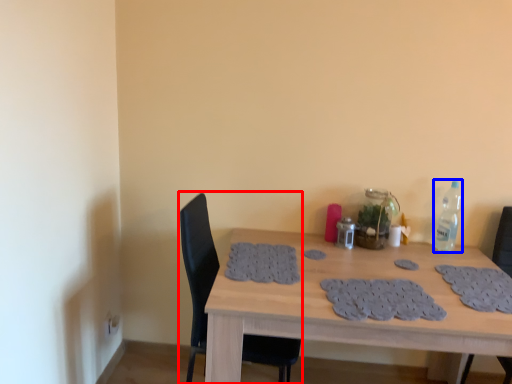
Question: Which object is further to the camera taking this photo, chair (highlighted by a red box) or bottle (highlighted by a blue box)?

Choices:
 (A) chair
 (B) bottle

Answer: (B)